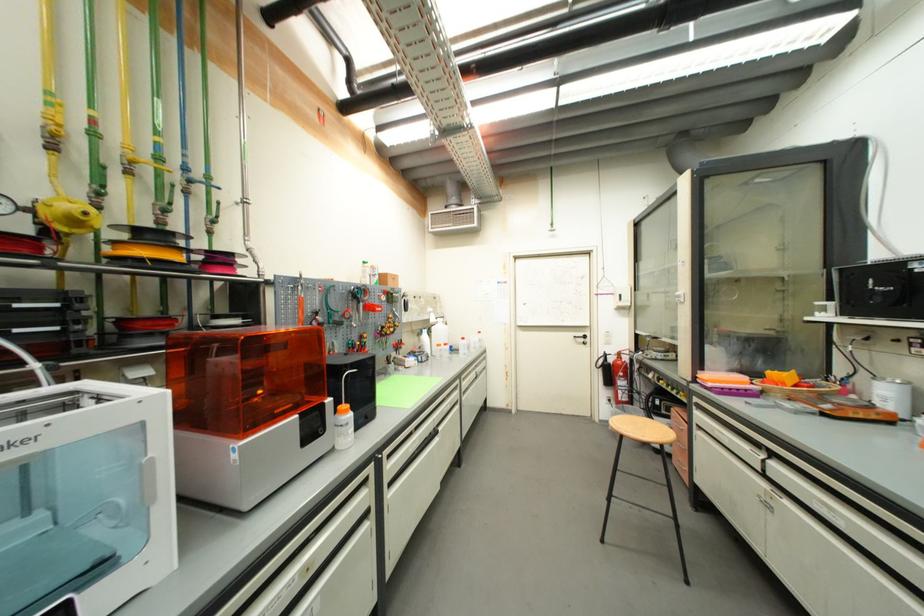
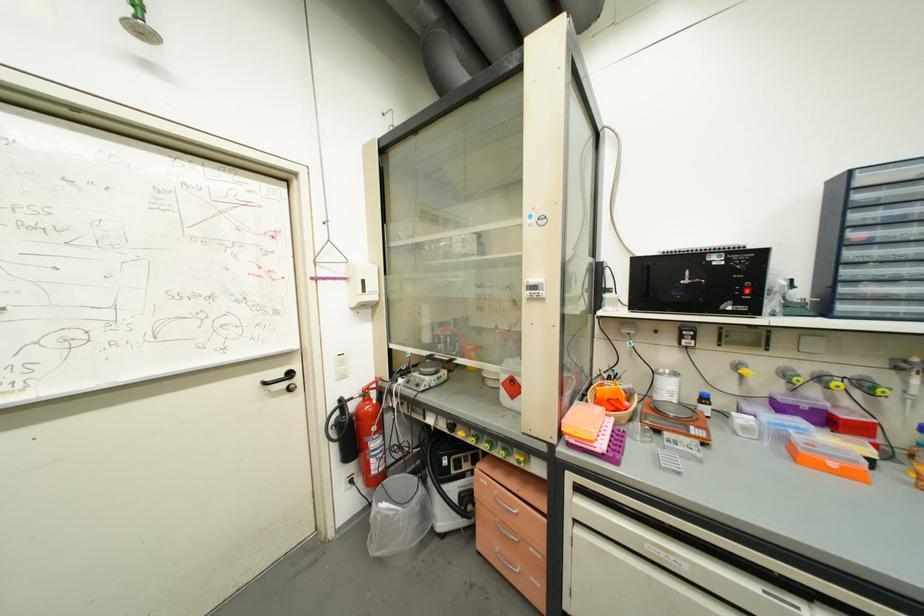
Find the pixel in the second image that matches [588,342] in the first image.

(289, 387)